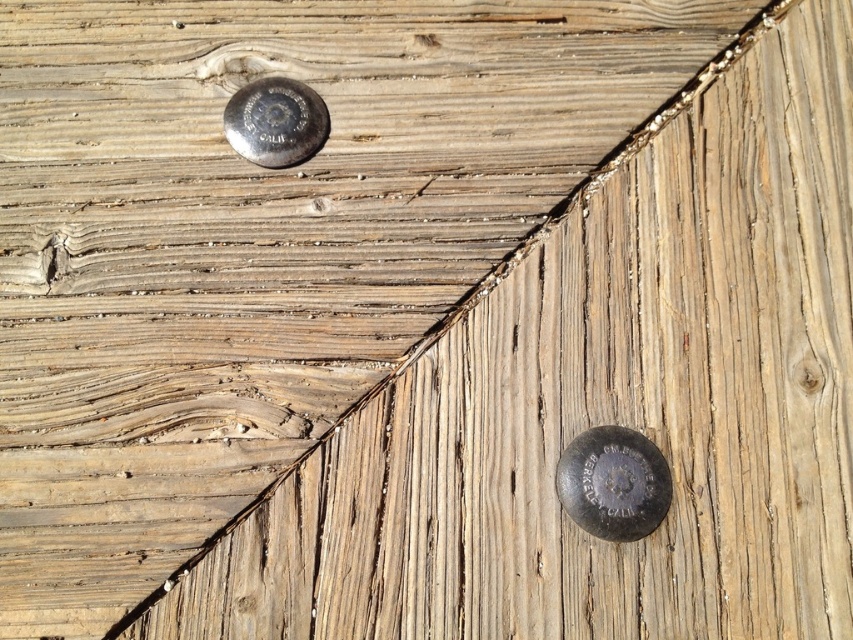
You are an inspector checking the structural integrity of the wooden planks. You notice two bolts securing them. The bolts are labeled as matte silver bolt at lower right and shiny silver bolt at upper center. Based on their sizes, which bolt might be more effective in holding the planks together?

The matte silver bolt at lower right has a larger width than the shiny silver bolt at upper center, so it might be more effective in holding the planks together due to its greater size.